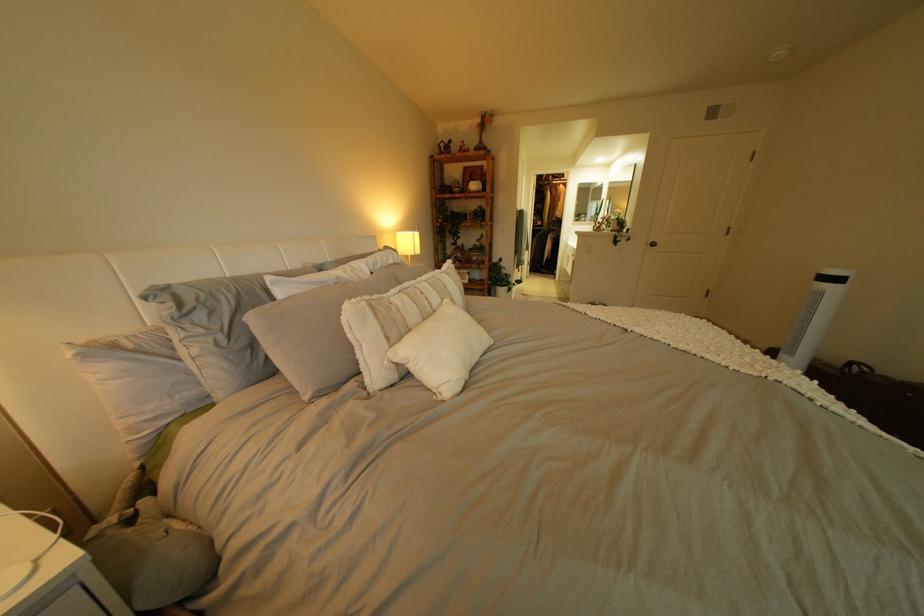
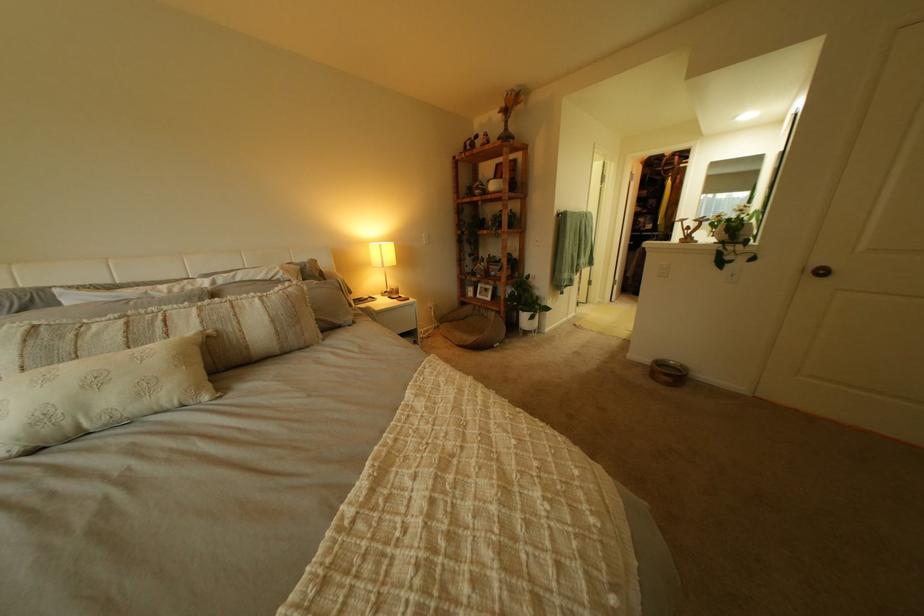
Where in the second image is the point corresponding to the point at 451,294 from the first image?

(213, 323)